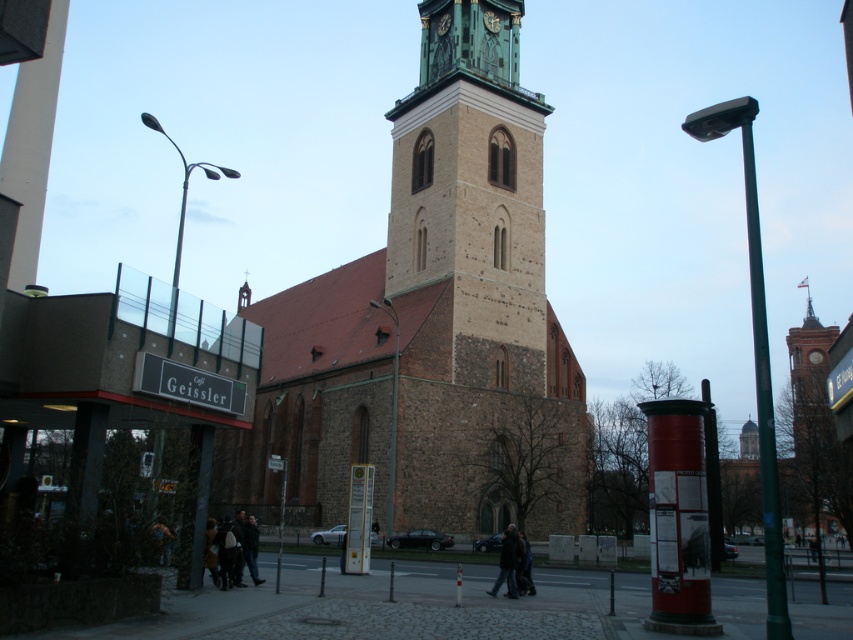
Can you confirm if brown stone church at center is wider than brown stone tower at center?

Yes, brown stone church at center is wider than brown stone tower at center.

Who is positioned more to the right, brown stone church at center or brown stone tower at center?

From the viewer's perspective, brown stone tower at center appears more on the right side.

Identify the location of brown stone church at center. The width and height of the screenshot is (853, 640). (434, 317).